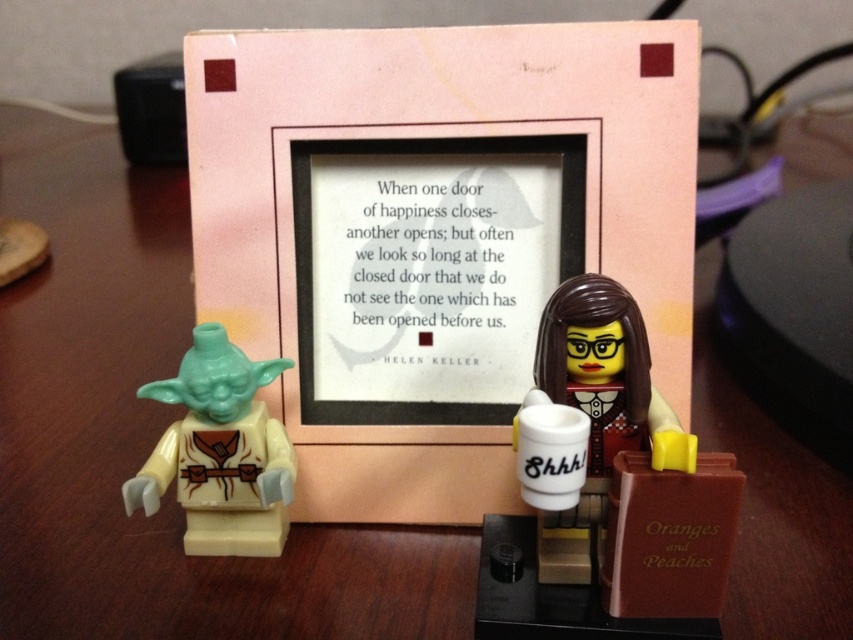
Is light green plastic yoda at left positioned in front of white glossy mug at center?

No.

Who is lower down, light green plastic yoda at left or white glossy mug at center?

light green plastic yoda at left is below.

Does point (286, 492) lie behind point (585, 369)?

Yes, point (286, 492) is behind point (585, 369).

Locate an element on the screen. light green plastic yoda at left is located at coordinates (219, 451).